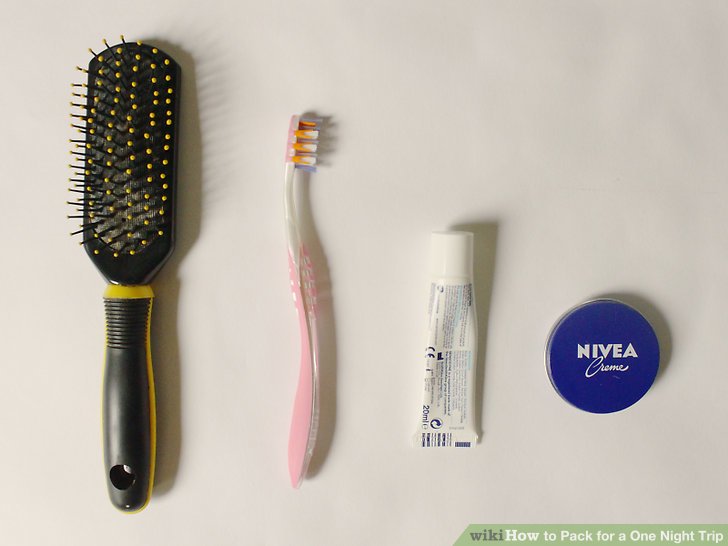
Locate an element on the screen. The width and height of the screenshot is (728, 546). toothbrush handle is located at coordinates (308, 397).